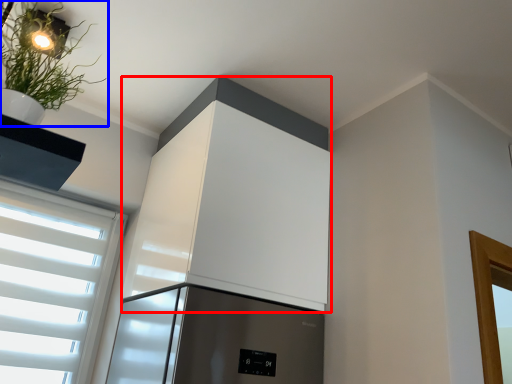
Question: Among these objects, which one is nearest to the camera, appliance (highlighted by a red box) or houseplant (highlighted by a blue box)?

Choices:
 (A) appliance
 (B) houseplant

Answer: (B)